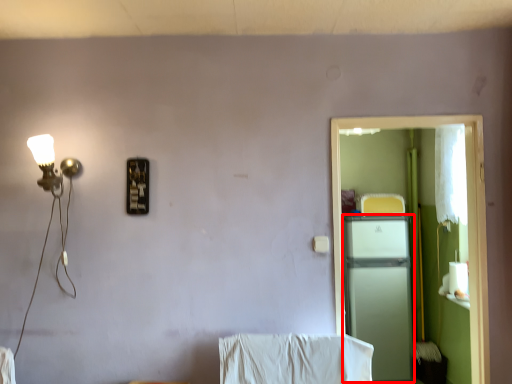
Question: From the image's perspective, considering the relative positions of appliance (annotated by the red box) and screen door in the image provided, where is appliance (annotated by the red box) located with respect to the staircase?

Choices:
 (A) above
 (B) below

Answer: (B)